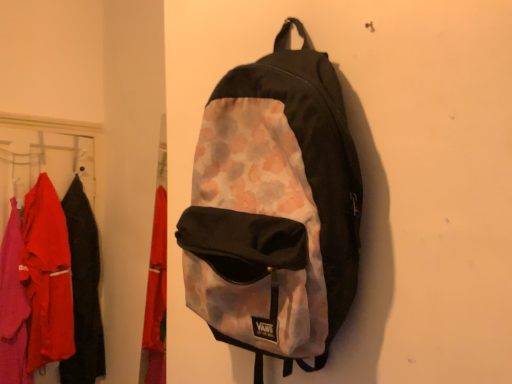
Describe the element at coordinates (274, 208) in the screenshot. I see `watercolor-patterned fabric backpack at center` at that location.

Measure the distance between watercolor-patterned fabric backpack at center and camera.

The distance of watercolor-patterned fabric backpack at center from camera is 21.61 inches.

Where is `matte black jacket at left`? matte black jacket at left is located at coordinates (83, 290).

This screenshot has width=512, height=384. What are the coordinates of `watercolor-patterned fabric backpack at center` in the screenshot? It's located at (274, 208).

Considering the sizes of matte fabric clothes at left and matte black jacket at left in the image, is matte fabric clothes at left bigger or smaller than matte black jacket at left?

Considering their sizes, matte fabric clothes at left takes up more space than matte black jacket at left.

Considering the sizes of objects matte fabric clothes at left and matte black jacket at left in the image provided, who is wider, matte fabric clothes at left or matte black jacket at left?

Wider between the two is matte black jacket at left.

Is matte fabric clothes at left to the left of matte black jacket at left from the viewer's perspective?

Yes.

From a real-world perspective, is watercolor-patterned fabric backpack at center above or below matte fabric clothes at left?

From a real-world perspective, watercolor-patterned fabric backpack at center is physically above matte fabric clothes at left.

Is watercolor-patterned fabric backpack at center closer to camera compared to matte fabric clothes at left?

Yes, it is in front of matte fabric clothes at left.

Does watercolor-patterned fabric backpack at center have a greater height compared to matte fabric clothes at left?

No, watercolor-patterned fabric backpack at center is not taller than matte fabric clothes at left.

Locate an element on the screen. Image resolution: width=512 pixels, height=384 pixels. closet below the watercolor-patterned fabric backpack at center (from a real-world perspective) is located at coordinates (39, 257).

Does matte black jacket at left have a lesser height compared to matte fabric clothes at left?

Yes.

Is matte black jacket at left further to camera compared to matte fabric clothes at left?

Yes, matte black jacket at left is behind matte fabric clothes at left.

Could you tell me if matte black jacket at left is facing matte fabric clothes at left?

Yes, matte black jacket at left is aimed at matte fabric clothes at left.

Is point (71, 234) closer to viewer compared to point (22, 308)?

No, it is behind (22, 308).

From a real-world perspective, is watercolor-patterned fabric backpack at center located beneath matte black jacket at left?

Actually, watercolor-patterned fabric backpack at center is physically above matte black jacket at left in the real world.

Is watercolor-patterned fabric backpack at center to the left or to the right of matte black jacket at left in the image?

Based on their positions, watercolor-patterned fabric backpack at center is located to the right of matte black jacket at left.

Where is `backpack on the right of matte black jacket at left`? Image resolution: width=512 pixels, height=384 pixels. backpack on the right of matte black jacket at left is located at coordinates point(274,208).

Considering the sizes of watercolor-patterned fabric backpack at center and matte black jacket at left in the image, is watercolor-patterned fabric backpack at center bigger or smaller than matte black jacket at left?

Clearly, watercolor-patterned fabric backpack at center is larger in size than matte black jacket at left.

Does matte fabric clothes at left turn towards watercolor-patterned fabric backpack at center?

No, matte fabric clothes at left is not aimed at watercolor-patterned fabric backpack at center.

You are a GUI agent. You are given a task and a screenshot of the screen. Output one action in this format:
    pyautogui.click(x=<x>, y=<y>)
    Task: Click on the closet that appears on the left of watercolor-patterned fabric backpack at center
    The width and height of the screenshot is (512, 384).
    Given the screenshot: What is the action you would take?
    pyautogui.click(x=39, y=257)

From the image's perspective, which one is positioned higher, matte fabric clothes at left or watercolor-patterned fabric backpack at center?

watercolor-patterned fabric backpack at center appears higher in the image.

Is matte fabric clothes at left at the right side of watercolor-patterned fabric backpack at center?

A: Incorrect, matte fabric clothes at left is not on the right side of watercolor-patterned fabric backpack at center.

Is matte black jacket at left further to the viewer compared to watercolor-patterned fabric backpack at center?

Yes, matte black jacket at left is further from the viewer.

Which object is positioned more to the left, matte black jacket at left or watercolor-patterned fabric backpack at center?

matte black jacket at left.

Considering the positions of point (80, 207) and point (290, 322), is point (80, 207) closer or farther from the camera than point (290, 322)?

Point (80, 207).

Can you tell me how much matte black jacket at left and watercolor-patterned fabric backpack at center differ in facing direction?

There is a 31.6-degree angle between the facing directions of matte black jacket at left and watercolor-patterned fabric backpack at center.

At what (x,y) coordinates should I click in order to perform the action: click on closet above the matte black jacket at left (from the image's perspective). Please return your answer as a coordinate pair (x, y). Image resolution: width=512 pixels, height=384 pixels. Looking at the image, I should click on (39, 257).

This screenshot has height=384, width=512. Find the location of `closet below the watercolor-patterned fabric backpack at center (from a real-world perspective)`. closet below the watercolor-patterned fabric backpack at center (from a real-world perspective) is located at coordinates (39, 257).

Estimate the real-world distances between objects in this image. Which object is closer to watercolor-patterned fabric backpack at center, matte fabric clothes at left or matte black jacket at left?

matte fabric clothes at left is closer to watercolor-patterned fabric backpack at center.

From the image, which object appears to be nearer to matte fabric clothes at left, matte black jacket at left or watercolor-patterned fabric backpack at center?

Among the two, matte black jacket at left is located nearer to matte fabric clothes at left.

Estimate the real-world distances between objects in this image. Which object is further from matte fabric clothes at left, watercolor-patterned fabric backpack at center or matte black jacket at left?

Among the two, watercolor-patterned fabric backpack at center is located further to matte fabric clothes at left.

Looking at the image, which one is located closer to watercolor-patterned fabric backpack at center, matte black jacket at left or matte fabric clothes at left?

matte fabric clothes at left.

When comparing their distances from matte black jacket at left, does watercolor-patterned fabric backpack at center or matte fabric clothes at left seem closer?

matte fabric clothes at left is positioned closer to the anchor matte black jacket at left.

Estimate the real-world distances between objects in this image. Which object is closer to matte black jacket at left, matte fabric clothes at left or watercolor-patterned fabric backpack at center?

matte fabric clothes at left is positioned closer to the anchor matte black jacket at left.

The width and height of the screenshot is (512, 384). What are the coordinates of `closet between watercolor-patterned fabric backpack at center and matte black jacket at left in the front-back direction` in the screenshot? It's located at (39, 257).